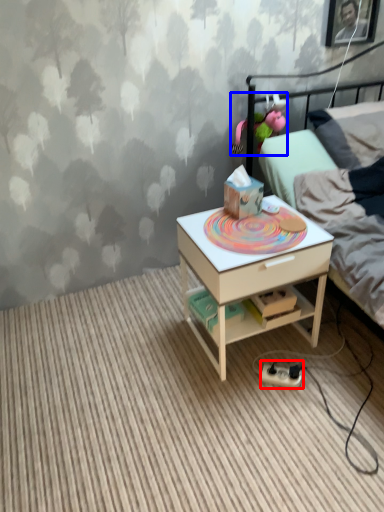
Question: Which of the following is the closest to the observer, equipment (highlighted by a red box) or toy (highlighted by a blue box)?

Choices:
 (A) equipment
 (B) toy

Answer: (A)